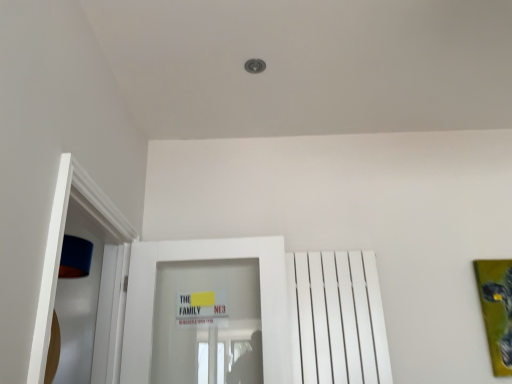
Question: Can you confirm if green matte painting at right is taller than white glossy door at center?

Choices:
 (A) no
 (B) yes

Answer: (A)

Question: Can you confirm if green matte painting at right is positioned to the right of white glossy door at center?

Choices:
 (A) yes
 (B) no

Answer: (A)

Question: Is green matte painting at right not within white glossy door at center?

Choices:
 (A) no
 (B) yes

Answer: (B)

Question: From a real-world perspective, is green matte painting at right under white glossy door at center?

Choices:
 (A) no
 (B) yes

Answer: (B)

Question: Is green matte painting at right surrounding white glossy door at center?

Choices:
 (A) yes
 (B) no

Answer: (B)

Question: From the image's perspective, is green matte painting at right on top of white glossy door at center?

Choices:
 (A) yes
 (B) no

Answer: (B)

Question: Can you confirm if white glossy door at center is bigger than white matte radiator at right?

Choices:
 (A) no
 (B) yes

Answer: (B)

Question: From the image's perspective, is white glossy door at center located beneath white matte radiator at right?

Choices:
 (A) no
 (B) yes

Answer: (A)

Question: From a real-world perspective, is white glossy door at center on top of white matte radiator at right?

Choices:
 (A) no
 (B) yes

Answer: (B)

Question: Is white glossy door at center positioned before white matte radiator at right?

Choices:
 (A) yes
 (B) no

Answer: (A)

Question: Does white glossy door at center have a lesser height compared to white matte radiator at right?

Choices:
 (A) yes
 (B) no

Answer: (B)

Question: Is white glossy door at center touching white matte radiator at right?

Choices:
 (A) no
 (B) yes

Answer: (A)

Question: Is white glossy door at center positioned before green matte painting at right?

Choices:
 (A) yes
 (B) no

Answer: (A)